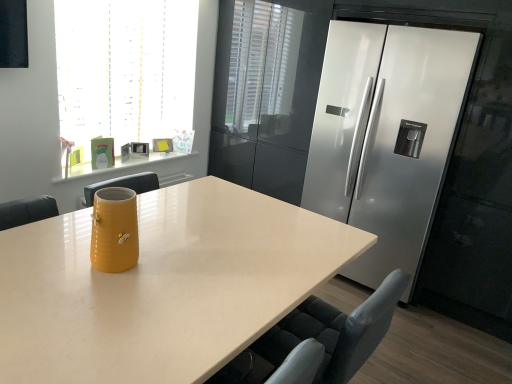
At what (x,y) coordinates should I click in order to perform the action: click on vacant position to the left of yellow ceramic vase at center. Please return your answer as a coordinate pair (x, y). Looking at the image, I should click on click(x=58, y=255).